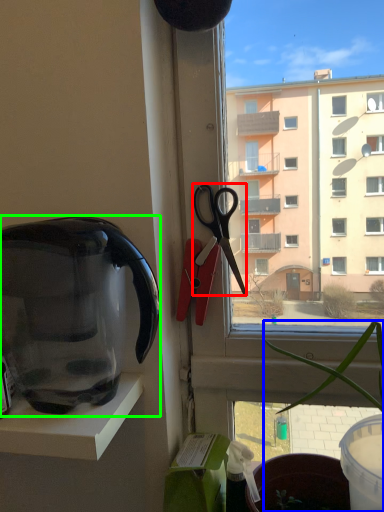
Question: Based on their relative distances, which object is nearer to scissors (highlighted by a red box)? Choose from houseplant (highlighted by a blue box) and kettle (highlighted by a green box).

Choices:
 (A) houseplant
 (B) kettle

Answer: (A)